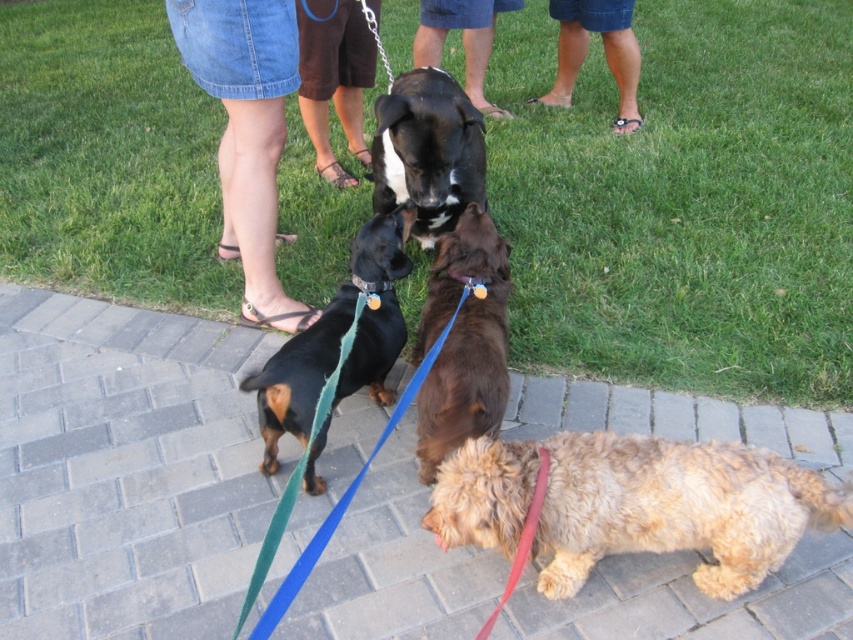
Question: Can you confirm if blue denim shorts at upper center is positioned to the left of blue fabric collar at center?

Choices:
 (A) yes
 (B) no

Answer: (B)

Question: Which of these objects is positioned farthest from the black glossy dog at center?

Choices:
 (A) brown fuzzy dog at center
 (B) blue denim shorts at upper center

Answer: (B)

Question: Is black glossy dog at center smaller than matte orange plastic at center?

Choices:
 (A) no
 (B) yes

Answer: (A)

Question: Which point appears farthest from the camera in this image?

Choices:
 (A) (433, 125)
 (B) (282, 605)
 (C) (193, 12)

Answer: (A)

Question: Can you confirm if brown denim shorts at lower center is thinner than blue denim shorts at upper center?

Choices:
 (A) yes
 (B) no

Answer: (A)

Question: Which of the following is the closest to the observer?

Choices:
 (A) (360, 288)
 (B) (426, 186)
 (C) (759, 99)

Answer: (A)